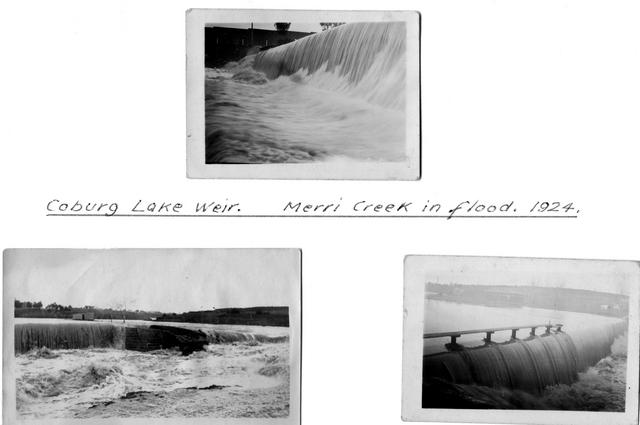
Find the location of a particular element. This screenshot has width=640, height=425. white frame is located at coordinates (220, 16).